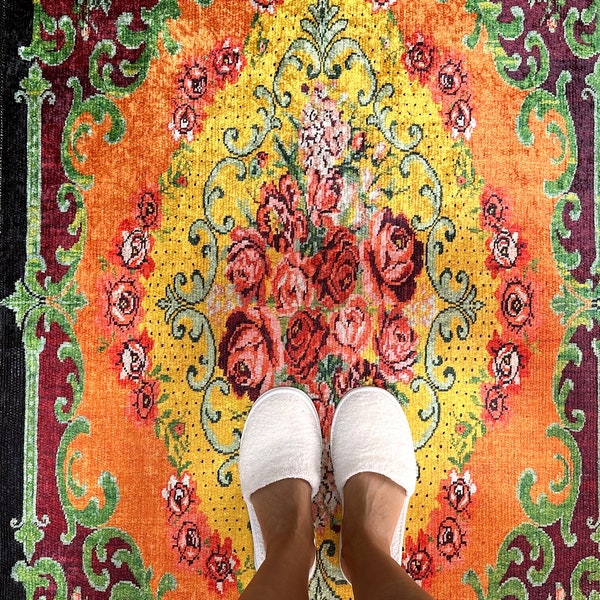
The height and width of the screenshot is (600, 600). In order to click on rug in this screenshot , I will do `click(249, 254)`.